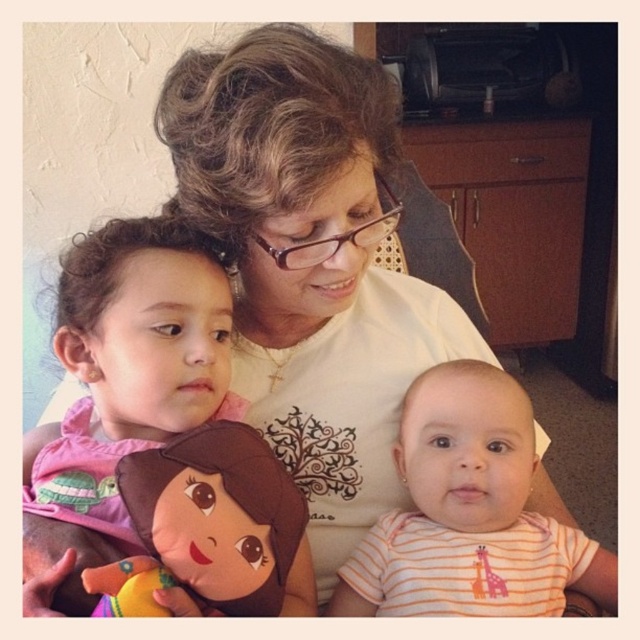
Can you confirm if pink fabric doll at left is smaller than brown plush toy at center?

No.

In the scene shown: Does pink fabric doll at left appear over brown plush toy at center?

Indeed, pink fabric doll at left is positioned over brown plush toy at center.

The width and height of the screenshot is (640, 640). What do you see at coordinates (131, 362) in the screenshot?
I see `pink fabric doll at left` at bounding box center [131, 362].

Identify the location of pink fabric doll at left. (131, 362).

Who is positioned more to the right, pink fabric doll at left or striped cotton baby at center?

From the viewer's perspective, striped cotton baby at center appears more on the right side.

The height and width of the screenshot is (640, 640). What do you see at coordinates (131, 362) in the screenshot?
I see `pink fabric doll at left` at bounding box center [131, 362].

Find the location of a particular element. This screenshot has height=640, width=640. pink fabric doll at left is located at coordinates (131, 362).

Is striped cotton baby at center closer to the viewer compared to brown plush toy at center?

No.

In the scene shown: Does striped cotton baby at center have a greater width compared to brown plush toy at center?

Yes.

Based on the photo, who is more distant from viewer, (424, 449) or (209, 420)?

The point (424, 449) is behind.

You are a GUI agent. You are given a task and a screenshot of the screen. Output one action in this format:
    pyautogui.click(x=<x>, y=<y>)
    Task: Click on the striped cotton baby at center
    This screenshot has height=640, width=640.
    Given the screenshot: What is the action you would take?
    pyautogui.click(x=468, y=513)